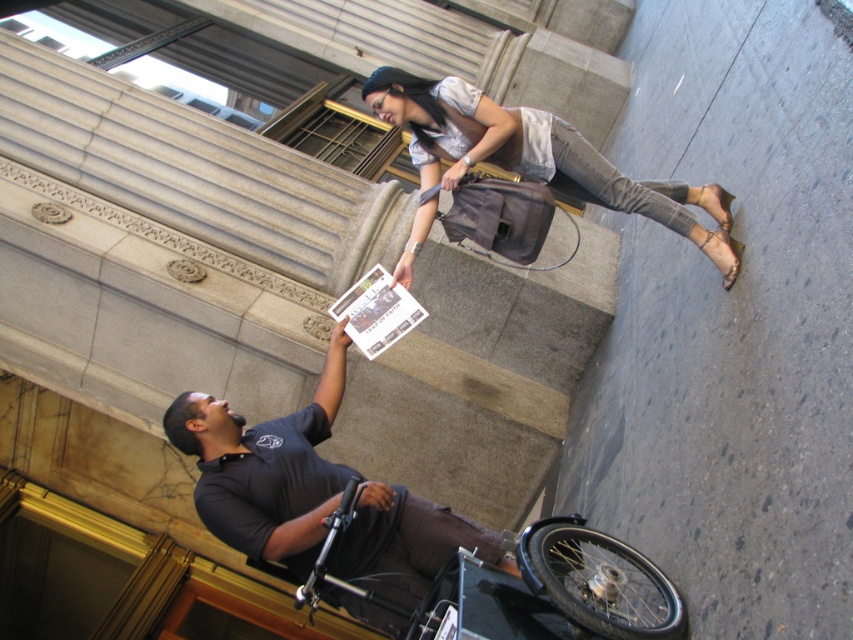
You are a delivery person who needs to park your bike near the black plastic wheelchair at lower center. According to the scene, where should you position your bike relative to the matte gray bag at upper center?

The matte gray bag at upper center is located above the black plastic wheelchair at lower center. To park your bike near the wheelchair, position it below the matte gray bag at upper center so it aligns with the wheelchair.

You are a pedestrian trying to cross the street in this urban scene. There is a dark gray shirt at center and a black plastic wheelchair at lower center. Which object is blocking your path more directly?

The dark gray shirt at center is positioned over the black plastic wheelchair at lower center, meaning the dark gray shirt at center is closer to your path and thus blocking it more directly.